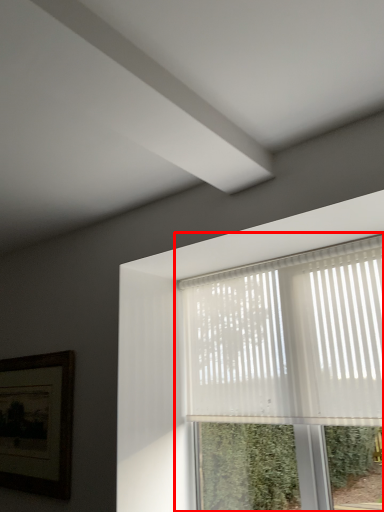
Question: Where is window (annotated by the red box) located in relation to picture frame in the image?

Choices:
 (A) right
 (B) left

Answer: (A)